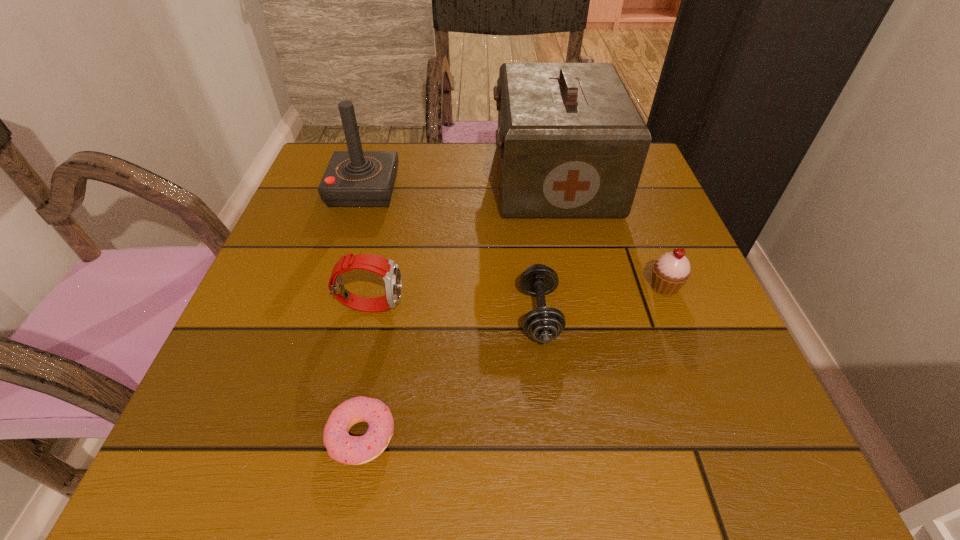
This screenshot has width=960, height=540. Identify the location of object positioned at the far left corner. (355, 178).

Identify the location of object that is positioned at the far right corner. This screenshot has height=540, width=960. (572, 144).

Where is `vacant area at the far edge`? vacant area at the far edge is located at coordinates (393, 148).

Identify the location of free space at the near edge of the desktop. (498, 456).

At what (x,y) coordinates should I click in order to perform the action: click on blank space at the left edge. Please return your answer as a coordinate pair (x, y). Looking at the image, I should click on (262, 401).

In the image, there is a desktop. Where is `vacant region at the right edge`? The image size is (960, 540). vacant region at the right edge is located at coordinates (736, 400).

In the image, there is a desktop. What are the coordinates of `vacant space at the far left corner` in the screenshot? It's located at (332, 148).

Locate an element on the screen. free point at the near left corner is located at coordinates (242, 436).

Image resolution: width=960 pixels, height=540 pixels. In the image, there is a desktop. What are the coordinates of `blank space at the far right corner` in the screenshot? It's located at (646, 166).

I want to click on free space at the near right corner of the desktop, so click(x=670, y=452).